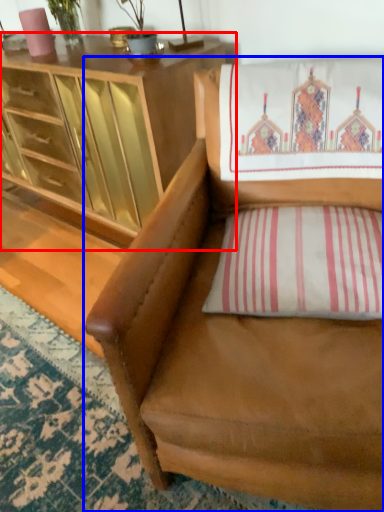
Question: Among these objects, which one is farthest to the camera, cabinetry (highlighted by a red box) or chair (highlighted by a blue box)?

Choices:
 (A) cabinetry
 (B) chair

Answer: (A)